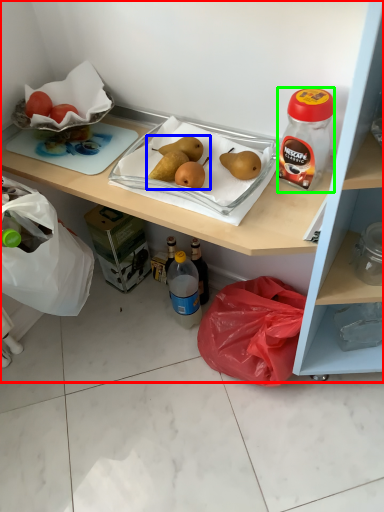
Question: Which is farther away from cabinetry (highlighted by a red box)? food (highlighted by a blue box) or bottle (highlighted by a green box)?

Choices:
 (A) food
 (B) bottle

Answer: (A)